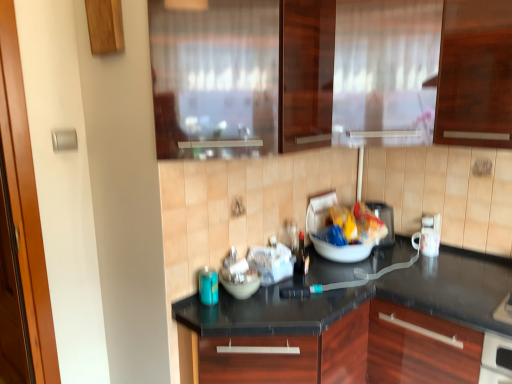
Question: Considering the relative positions of matte plastic bag at center and white glossy mug at right, the first appliance when ordered from right to left, in the image provided, is matte plastic bag at center in front of white glossy mug at right, the first appliance when ordered from right to left,?

Choices:
 (A) no
 (B) yes

Answer: (B)

Question: Would you consider matte plastic bag at center to be distant from white glossy mug at right, the second appliance in the back-to-front sequence?

Choices:
 (A) no
 (B) yes

Answer: (A)

Question: Can you see matte plastic bag at center touching white glossy mug at right, which appears as the third appliance when viewed from the left?

Choices:
 (A) no
 (B) yes

Answer: (A)

Question: Considering the relative sizes of matte plastic bag at center and white glossy mug at right, which is the 2th appliance in front-to-back order, in the image provided, is matte plastic bag at center wider than white glossy mug at right, which is the 2th appliance in front-to-back order,?

Choices:
 (A) yes
 (B) no

Answer: (A)

Question: Is matte plastic bag at center bigger than white glossy mug at right, the second appliance in the back-to-front sequence?

Choices:
 (A) no
 (B) yes

Answer: (B)

Question: From a real-world perspective, is matte plastic bag at center located higher than white glossy mug at right, the second appliance in the back-to-front sequence?

Choices:
 (A) yes
 (B) no

Answer: (A)

Question: From a real-world perspective, is black granite countertop at center below white glossy mug at right, which is the 2th appliance in front-to-back order?

Choices:
 (A) yes
 (B) no

Answer: (A)

Question: Can you confirm if black granite countertop at center is taller than white glossy mug at right, which appears as the third appliance when viewed from the left?

Choices:
 (A) no
 (B) yes

Answer: (B)

Question: Does black granite countertop at center lie behind white glossy mug at right, the second appliance in the back-to-front sequence?

Choices:
 (A) yes
 (B) no

Answer: (B)

Question: Can you confirm if black granite countertop at center is shorter than white glossy mug at right, the second appliance in the back-to-front sequence?

Choices:
 (A) no
 (B) yes

Answer: (A)

Question: Is black granite countertop at center not near white glossy mug at right, which appears as the third appliance when viewed from the left?

Choices:
 (A) yes
 (B) no

Answer: (B)

Question: Is black granite countertop at center bigger than white glossy mug at right, which is the 2th appliance in front-to-back order?

Choices:
 (A) yes
 (B) no

Answer: (A)

Question: From a real-world perspective, does transparent glass window at upper center sit lower than matte plastic bag at center?

Choices:
 (A) no
 (B) yes

Answer: (A)